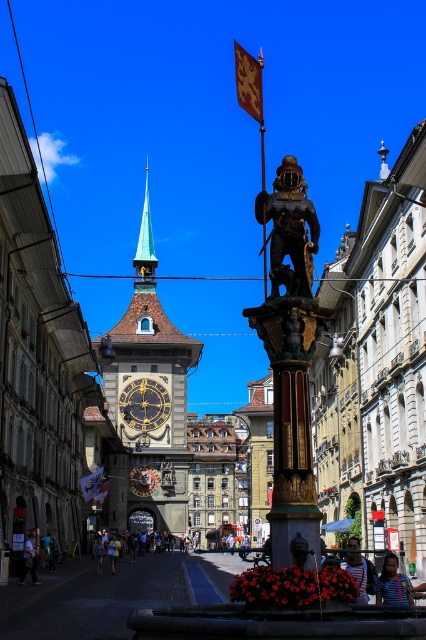
Question: Among these objects, which one is nearest to the camera?

Choices:
 (A) gold-plated clock tower at center
 (B) gold textured flag at upper center

Answer: (B)

Question: Can you confirm if shiny bronze knight at center is positioned to the left of gold polished metal pole at center?

Choices:
 (A) yes
 (B) no

Answer: (A)

Question: Is gold-plated clock tower at center thinner than bronze statue at center?

Choices:
 (A) no
 (B) yes

Answer: (A)

Question: Is gold metallic clock at center below gold textured flag at upper center?

Choices:
 (A) no
 (B) yes

Answer: (B)

Question: Which object is farther from the camera taking this photo?

Choices:
 (A) gold textured flag at upper center
 (B) gold metallic flag at center

Answer: (B)

Question: Which point is closer to the camera?

Choices:
 (A) (270, 202)
 (B) (111, 456)
 (C) (85, 477)
 (D) (241, 49)

Answer: (A)